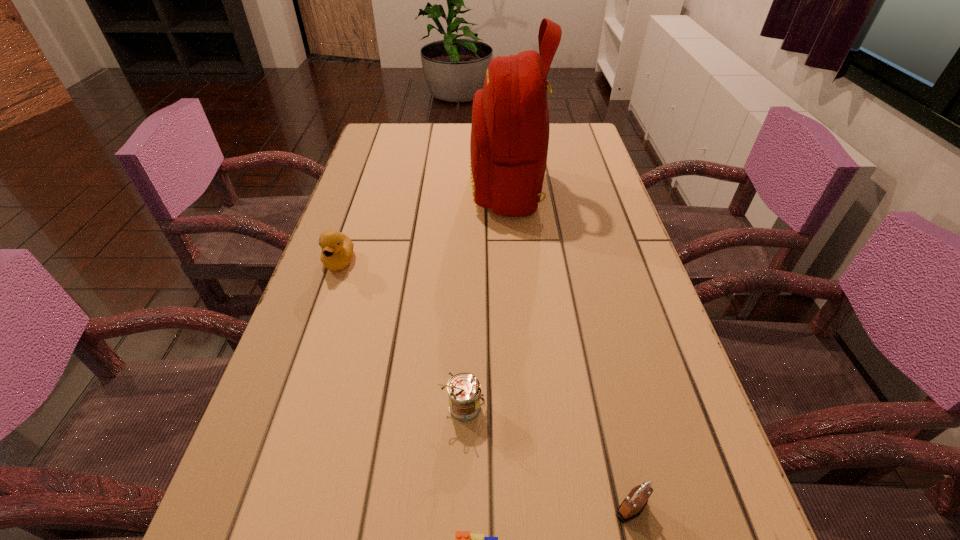
At what (x,y) coordinates should I click in order to perform the action: click on the tallest object. Please return your answer as a coordinate pair (x, y). The width and height of the screenshot is (960, 540). Looking at the image, I should click on (510, 127).

Where is `the farthest object`? the farthest object is located at coordinates (510, 127).

Where is `the third nearest object`? The width and height of the screenshot is (960, 540). the third nearest object is located at coordinates (464, 393).

At what (x,y) coordinates should I click in order to perform the action: click on the second farthest object. Please return your answer as a coordinate pair (x, y). Looking at the image, I should click on (337, 249).

Identify the location of duckling. This screenshot has height=540, width=960. (337, 249).

You are a GUI agent. You are given a task and a screenshot of the screen. Output one action in this format:
    pyautogui.click(x=<x>, y=<y>)
    Task: Click on the padlock
    Image resolution: width=960 pixels, height=540 pixels.
    Given the screenshot: What is the action you would take?
    pyautogui.click(x=632, y=506)

This screenshot has height=540, width=960. What are the coordinates of `the rightmost object` in the screenshot? It's located at (632, 506).

You are a GUI agent. You are given a task and a screenshot of the screen. Output one action in this format:
    pyautogui.click(x=<x>, y=<y>)
    Task: Click on the free location located 0.090m on the front-facing side of the backpack
    The height and width of the screenshot is (540, 960).
    Given the screenshot: What is the action you would take?
    pyautogui.click(x=439, y=188)

The width and height of the screenshot is (960, 540). In order to click on vacant space located on the front-facing side of the backpack in this screenshot , I will do `click(353, 188)`.

This screenshot has width=960, height=540. In order to click on vacant region located on the front-facing side of the backpack in this screenshot , I will do `click(374, 188)`.